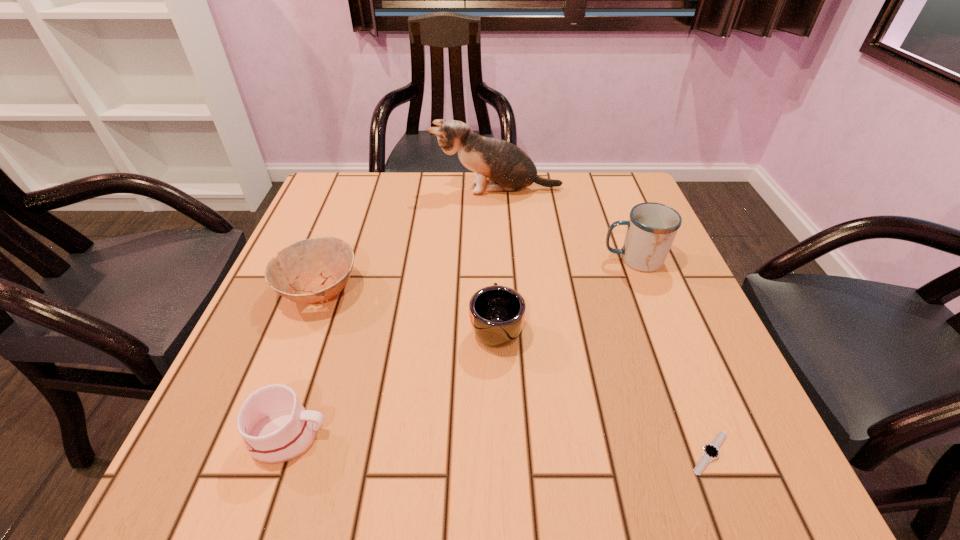
You are a GUI agent. You are given a task and a screenshot of the screen. Output one action in this format:
    pyautogui.click(x=<x>, y=<y>)
    Task: Click on the vacant space that satisfies the following two spatial constraints: 1. on the handle side of the watch; 2. on the right side of the rightmost mug
    
    Given the screenshot: What is the action you would take?
    pyautogui.click(x=708, y=453)

Identify the location of free point that satisfies the following two spatial constraints: 1. on the side with the handle of the shortest object; 2. on the left side of the leftmost mug. (282, 453).

Locate an element on the screen. The height and width of the screenshot is (540, 960). free point that satisfies the following two spatial constraints: 1. at the face of the tallest object; 2. on the front side of the bowl is located at coordinates (503, 290).

The width and height of the screenshot is (960, 540). In order to click on vacant space that satisfies the following two spatial constraints: 1. on the handle side of the rightmost mug; 2. on the back side of the watch in this screenshot , I will do `click(708, 453)`.